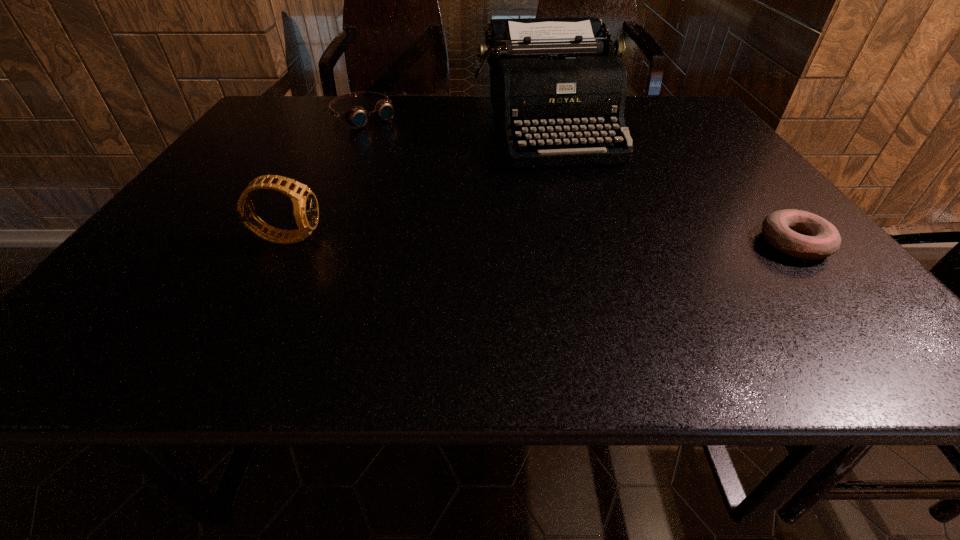
In the image, there is a desktop. In order to click on vacant space at the right edge in this screenshot , I will do `click(725, 200)`.

Identify the location of free point at the far left corner. (296, 114).

This screenshot has height=540, width=960. I want to click on blank space at the far right corner, so click(659, 119).

Where is `vacant point located between the third object from left to right and the third tallest object`? vacant point located between the third object from left to right and the third tallest object is located at coordinates (455, 123).

This screenshot has height=540, width=960. Find the location of `free space that is in between the typewriter and the rightmost object`. free space that is in between the typewriter and the rightmost object is located at coordinates (x=670, y=186).

In order to click on free space between the goggles and the third shortest object in this screenshot , I will do `click(326, 177)`.

Locate an element on the screen. free point between the watch and the third tallest object is located at coordinates (326, 177).

Where is `free space between the goggles and the shortest object`? This screenshot has height=540, width=960. free space between the goggles and the shortest object is located at coordinates (579, 180).

You are a GUI agent. You are given a task and a screenshot of the screen. Output one action in this format:
    pyautogui.click(x=<x>, y=<y>)
    Task: Click on the vacant area that lies between the shortest object and the goggles
    This screenshot has width=960, height=540.
    Given the screenshot: What is the action you would take?
    pyautogui.click(x=579, y=180)

At what (x,y) coordinates should I click in order to perform the action: click on free space between the second tallest object and the second object from right to left. Please return your answer as a coordinate pair (x, y). Image resolution: width=960 pixels, height=540 pixels. Looking at the image, I should click on (418, 183).